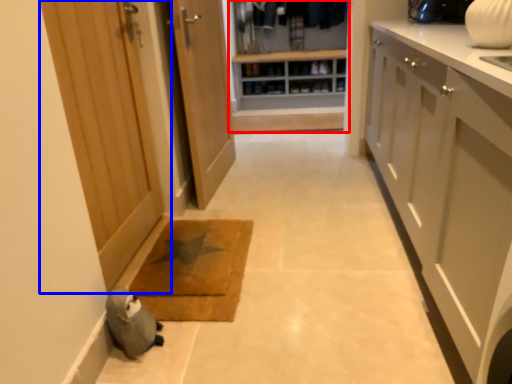
Question: Which point is closer to the camera, closet (highlighted by a red box) or door (highlighted by a blue box)?

Choices:
 (A) closet
 (B) door

Answer: (B)